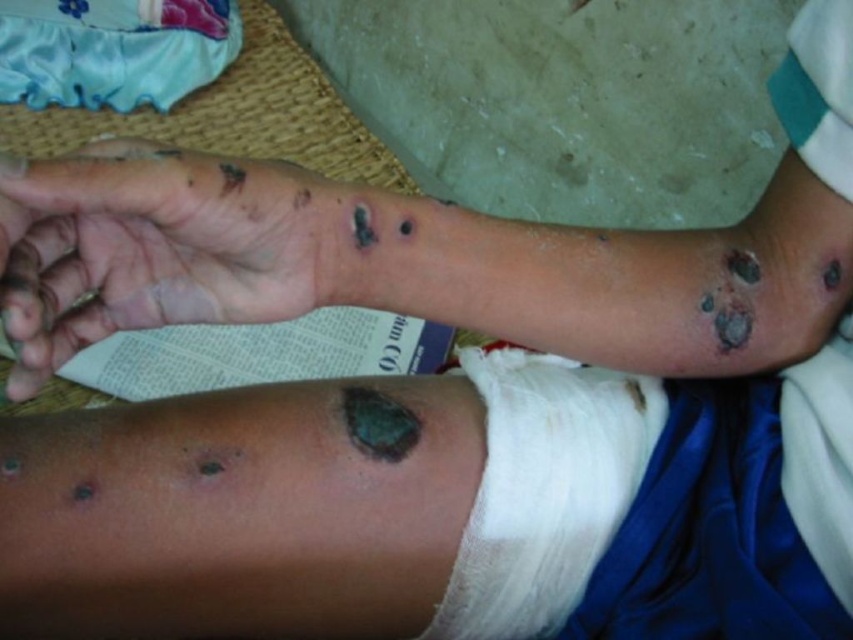
Question: Is black matte skin at lower left closer to camera compared to white cotton bandage at lower center?

Choices:
 (A) yes
 (B) no

Answer: (A)

Question: Does black matte skin at lower left appear on the left side of white cotton bandage at lower center?

Choices:
 (A) no
 (B) yes

Answer: (B)

Question: Can you confirm if black matte skin at lower left is smaller than white cotton bandage at lower center?

Choices:
 (A) yes
 (B) no

Answer: (A)

Question: Among these objects, which one is farthest from the camera?

Choices:
 (A) white cotton bandage at lower center
 (B) black matte skin at lower left

Answer: (A)

Question: Which point is farther from the camera taking this photo?

Choices:
 (A) (146, 264)
 (B) (614, 397)

Answer: (B)